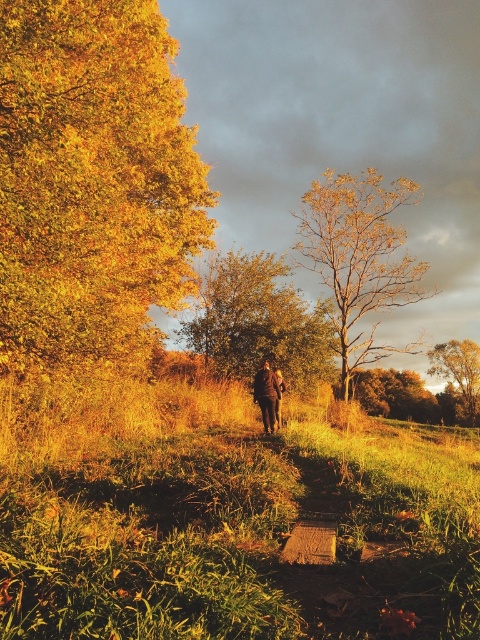
Question: Which object appears farthest from the camera in this image?

Choices:
 (A) brown leather jacket at center
 (B) brown textured tree at center
 (C) golden textured tree at center

Answer: (B)

Question: Among these points, which one is farthest from the camera?

Choices:
 (A) (455, 344)
 (B) (38, 272)
 (C) (262, 413)
 (D) (278, 301)

Answer: (A)

Question: Does golden textured tree at upper right appear over brown leather jacket at center?

Choices:
 (A) no
 (B) yes

Answer: (A)

Question: Is the position of golden leafy tree at left more distant than that of brown leather jacket at center?

Choices:
 (A) no
 (B) yes

Answer: (A)

Question: Is golden leafy tree at left above brown leather jacket at center?

Choices:
 (A) yes
 (B) no

Answer: (A)

Question: Which object is closer to the camera taking this photo?

Choices:
 (A) golden textured tree at center
 (B) brown textured tree at center
 (C) golden textured tree at upper right

Answer: (A)